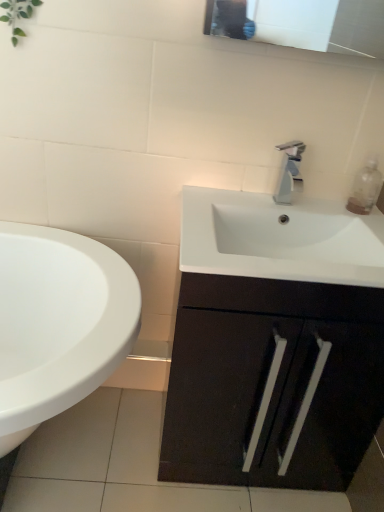
Question: Is white glossy sink at lower left at the left side of clear plastic bottle at upper right?

Choices:
 (A) yes
 (B) no

Answer: (A)

Question: Is white glossy sink at lower left closer to the viewer compared to clear plastic bottle at upper right?

Choices:
 (A) no
 (B) yes

Answer: (B)

Question: Considering the relative sizes of white glossy sink at lower left and clear plastic bottle at upper right in the image provided, is white glossy sink at lower left smaller than clear plastic bottle at upper right?

Choices:
 (A) no
 (B) yes

Answer: (A)

Question: From a real-world perspective, does white glossy sink at lower left stand above clear plastic bottle at upper right?

Choices:
 (A) yes
 (B) no

Answer: (B)

Question: From a real-world perspective, does white glossy sink at lower left sit lower than clear plastic bottle at upper right?

Choices:
 (A) no
 (B) yes

Answer: (B)

Question: Is white glossy sink at lower left looking in the opposite direction of clear plastic bottle at upper right?

Choices:
 (A) yes
 (B) no

Answer: (B)

Question: From the image's perspective, is clear plastic bottle at upper right located beneath silver metallic faucet at center?

Choices:
 (A) no
 (B) yes

Answer: (B)

Question: Is clear plastic bottle at upper right shorter than silver metallic faucet at center?

Choices:
 (A) no
 (B) yes

Answer: (B)

Question: Is clear plastic bottle at upper right far from silver metallic faucet at center?

Choices:
 (A) yes
 (B) no

Answer: (B)

Question: Considering the relative positions of clear plastic bottle at upper right and silver metallic faucet at center in the image provided, is clear plastic bottle at upper right in front of silver metallic faucet at center?

Choices:
 (A) yes
 (B) no

Answer: (B)

Question: Is clear plastic bottle at upper right in contact with silver metallic faucet at center?

Choices:
 (A) yes
 (B) no

Answer: (B)

Question: Can you confirm if clear plastic bottle at upper right is thinner than silver metallic faucet at center?

Choices:
 (A) yes
 (B) no

Answer: (A)

Question: Does silver metallic faucet at center appear on the right side of white glossy sink at lower left?

Choices:
 (A) no
 (B) yes

Answer: (B)